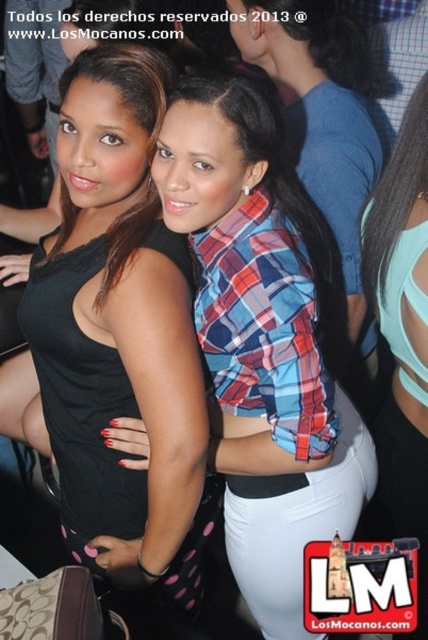
Question: Does black matte tank top at center have a lesser width compared to light blue fabric top at center?

Choices:
 (A) no
 (B) yes

Answer: (A)

Question: Where is plaid fabric shirt at center located in relation to light blue fabric top at center in the image?

Choices:
 (A) right
 (B) left

Answer: (B)

Question: Can you confirm if black matte tank top at center is bigger than light blue fabric top at center?

Choices:
 (A) no
 (B) yes

Answer: (B)

Question: Estimate the real-world distances between objects in this image. Which object is farther from the black matte tank top at center?

Choices:
 (A) plaid fabric shirt at center
 (B) light blue fabric top at center

Answer: (B)

Question: Which of the following is the farthest from the observer?

Choices:
 (A) (80, 205)
 (B) (272, 524)
 (C) (421, 193)

Answer: (B)

Question: Which point appears farthest from the camera in this image?

Choices:
 (A) (401, 508)
 (B) (296, 502)
 (C) (101, 124)

Answer: (A)